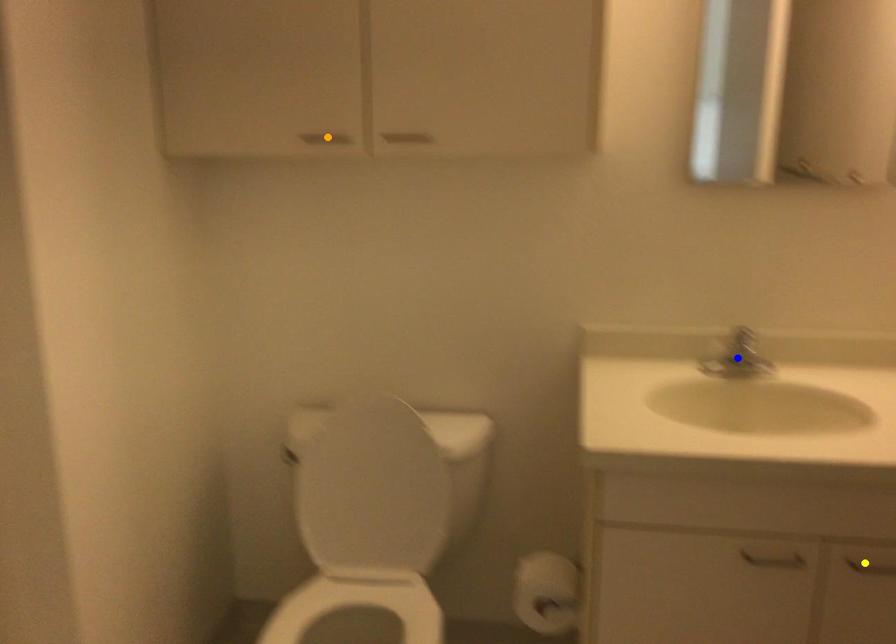
Order these from nearest to farthest:
yellow point, blue point, orange point

yellow point
orange point
blue point